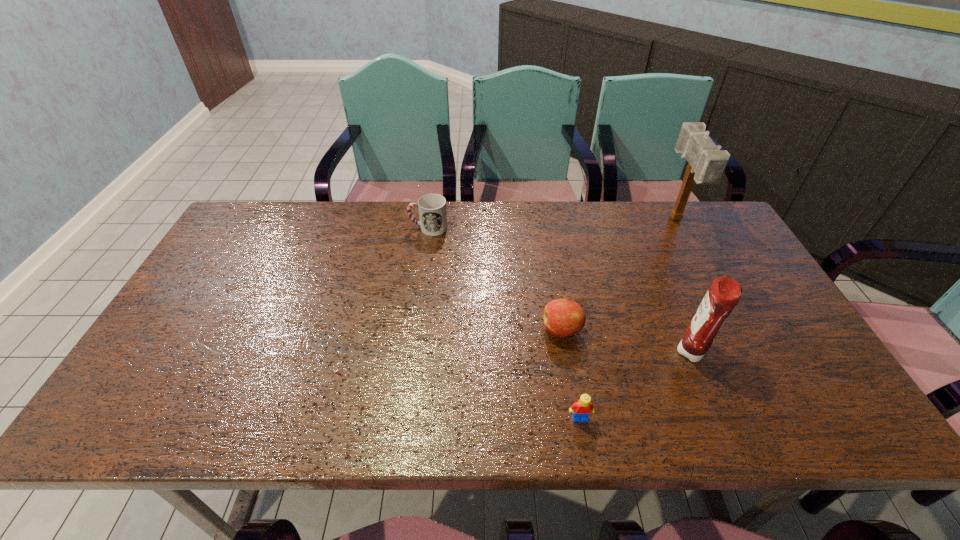
Find the location of `the rightmost object`. the rightmost object is located at coordinates (707, 162).

In order to click on the tallest object in this screenshot , I will do `click(707, 162)`.

Locate an element on the screen. The height and width of the screenshot is (540, 960). condiment is located at coordinates (724, 293).

I want to click on the second tallest object, so click(724, 293).

This screenshot has width=960, height=540. I want to click on cup, so (x=432, y=207).

Where is `apple`? apple is located at coordinates (562, 317).

At what (x,y) coordinates should I click in order to perform the action: click on Lego. Please return your answer as a coordinate pair (x, y). Looking at the image, I should click on (582, 408).

The height and width of the screenshot is (540, 960). Find the location of `free space located 0.340m on the front of the tallest object`. free space located 0.340m on the front of the tallest object is located at coordinates [x=732, y=323].

The image size is (960, 540). I want to click on blank space located 0.310m on the back of the fourth shortest object, so click(652, 256).

At what (x,y) coordinates should I click in order to perform the action: click on vacant area located on the side of the cup where the handle is located. Please return your answer as a coordinate pair (x, y). The width and height of the screenshot is (960, 540). Looking at the image, I should click on (348, 227).